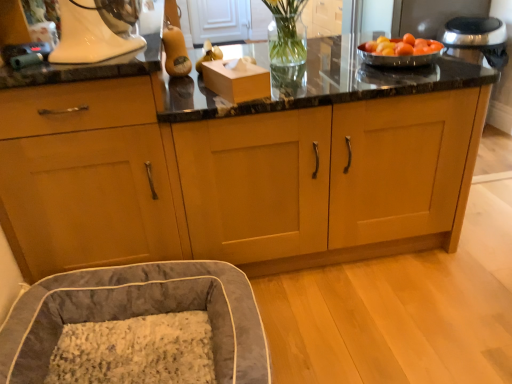
Locate an element on the screen. This screenshot has width=512, height=384. white glossy stand mixer at upper left is located at coordinates (96, 30).

At what (x,y) coordinates should I click in order to perform the action: click on matte wood cabinet at lower left, which appears as the 2th cabinetry when viewed from the right. Please return your answer as a coordinate pair (x, y). The image size is (512, 384). Looking at the image, I should click on (87, 178).

Describe the element at coordinates (87, 178) in the screenshot. I see `matte wood cabinet at lower left, which ranks as the first cabinetry in left-to-right order` at that location.

Locate an element on the screen. The image size is (512, 384). velvet gray bean bag at lower left is located at coordinates (138, 314).

In the scene shown: Is matte wood cabinet at lower left, which appears as the 2th cabinetry when viewed from the right, inside the boundaries of silver metallic bowl at upper right, or outside?

matte wood cabinet at lower left, which appears as the 2th cabinetry when viewed from the right, is outside silver metallic bowl at upper right.

Considering the sizes of objects matte wood cabinet at lower left, which appears as the 2th cabinetry when viewed from the right, and silver metallic bowl at upper right in the image provided, who is taller, matte wood cabinet at lower left, which appears as the 2th cabinetry when viewed from the right, or silver metallic bowl at upper right?

With more height is matte wood cabinet at lower left, which appears as the 2th cabinetry when viewed from the right.

From the picture: Does matte wood cabinet at lower left, which appears as the 2th cabinetry when viewed from the right, have a greater width compared to silver metallic bowl at upper right?

Yes.

From a real-world perspective, is matte wood cabinets at center, the 2th cabinetry when ordered from left to right, under matte wood cabinet at lower left, which ranks as the first cabinetry in left-to-right order?

Yes, from a real-world perspective, matte wood cabinets at center, the 2th cabinetry when ordered from left to right, is below matte wood cabinet at lower left, which ranks as the first cabinetry in left-to-right order.

Is matte wood cabinet at lower left, which appears as the 2th cabinetry when viewed from the right, at the back of matte wood cabinets at center, the 1th cabinetry in the right-to-left sequence?

No.

Can you confirm if matte wood cabinets at center, the 2th cabinetry when ordered from left to right, is smaller than matte wood cabinet at lower left, which ranks as the first cabinetry in left-to-right order?

Yes, matte wood cabinets at center, the 2th cabinetry when ordered from left to right, is smaller than matte wood cabinet at lower left, which ranks as the first cabinetry in left-to-right order.

From a real-world perspective, which object stands above the other?

In real-world perspective, matte wood cabinet at lower left, which appears as the 2th cabinetry when viewed from the right, is above.

Considering the relative sizes of matte wood cabinet at lower left, which ranks as the first cabinetry in left-to-right order, and velvet gray bean bag at lower left in the image provided, is matte wood cabinet at lower left, which ranks as the first cabinetry in left-to-right order, smaller than velvet gray bean bag at lower left?

Incorrect, matte wood cabinet at lower left, which ranks as the first cabinetry in left-to-right order, is not smaller in size than velvet gray bean bag at lower left.

Is matte wood cabinet at lower left, which ranks as the first cabinetry in left-to-right order, not within velvet gray bean bag at lower left?

matte wood cabinet at lower left, which ranks as the first cabinetry in left-to-right order, is positioned outside velvet gray bean bag at lower left.

Is velvet gray bean bag at lower left at the back of matte wood cabinet at lower left, which appears as the 2th cabinetry when viewed from the right?

No, matte wood cabinet at lower left, which appears as the 2th cabinetry when viewed from the right, is not facing the opposite direction of velvet gray bean bag at lower left.

Is matte wood cabinet at lower left, which ranks as the first cabinetry in left-to-right order, not within matte wood cabinets at center, the 1th cabinetry in the right-to-left sequence?

Indeed, matte wood cabinet at lower left, which ranks as the first cabinetry in left-to-right order, is completely outside matte wood cabinets at center, the 1th cabinetry in the right-to-left sequence.

Can you confirm if matte wood cabinet at lower left, which ranks as the first cabinetry in left-to-right order, is smaller than matte wood cabinets at center, the 1th cabinetry in the right-to-left sequence?

No.

How many degrees apart are the facing directions of matte wood cabinet at lower left, which appears as the 2th cabinetry when viewed from the right, and matte wood cabinets at center, the 2th cabinetry when ordered from left to right?

There is a 90-degree angle between the facing directions of matte wood cabinet at lower left, which appears as the 2th cabinetry when viewed from the right, and matte wood cabinets at center, the 2th cabinetry when ordered from left to right.

How much distance is there between matte wood cabinet at lower left, which ranks as the first cabinetry in left-to-right order, and matte wood cabinets at center, the 1th cabinetry in the right-to-left sequence?

matte wood cabinet at lower left, which ranks as the first cabinetry in left-to-right order, and matte wood cabinets at center, the 1th cabinetry in the right-to-left sequence, are 6.77 inches apart from each other.

Between point (269, 210) and point (393, 45), which one is positioned in front?

Positioned in front is point (269, 210).

How many degrees apart are the facing directions of matte wood cabinets at center, the 2th cabinetry when ordered from left to right, and silver metallic bowl at upper right?

They differ by 2.99 degrees in their facing directions.

From their relative heights in the image, would you say matte wood cabinets at center, the 1th cabinetry in the right-to-left sequence, is taller or shorter than silver metallic bowl at upper right?

In the image, matte wood cabinets at center, the 1th cabinetry in the right-to-left sequence, appears to be taller than silver metallic bowl at upper right.

This screenshot has height=384, width=512. What are the coordinates of `the 1st cabinetry to the left of the silver metallic bowl at upper right, counting from the anchor's position` in the screenshot? It's located at (239, 172).

Between point (375, 59) and point (251, 338), which one is positioned in front?

The point (251, 338) is closer to the camera.

How different are the orientations of silver metallic bowl at upper right and velvet gray bean bag at lower left in degrees?

The facing directions of silver metallic bowl at upper right and velvet gray bean bag at lower left are 3.19 degrees apart.

Which is more to the left, silver metallic bowl at upper right or velvet gray bean bag at lower left?

Positioned to the left is velvet gray bean bag at lower left.

From the image's perspective, is matte wood cabinets at center, the 2th cabinetry when ordered from left to right, below velvet gray bean bag at lower left?

No, from the image's perspective, matte wood cabinets at center, the 2th cabinetry when ordered from left to right, is not below velvet gray bean bag at lower left.

Choose the correct answer: Is matte wood cabinets at center, the 1th cabinetry in the right-to-left sequence, inside velvet gray bean bag at lower left or outside it?

matte wood cabinets at center, the 1th cabinetry in the right-to-left sequence, is not inside velvet gray bean bag at lower left, it's outside.

Is matte wood cabinets at center, the 1th cabinetry in the right-to-left sequence, shorter than velvet gray bean bag at lower left?

Incorrect, the height of matte wood cabinets at center, the 1th cabinetry in the right-to-left sequence, does not fall short of that of velvet gray bean bag at lower left.

Considering the positions of points (263, 172) and (221, 305), is point (263, 172) closer to camera compared to point (221, 305)?

No, it is behind (221, 305).

The image size is (512, 384). In order to click on kitchen appliance above the matte wood cabinet at lower left, which ranks as the first cabinetry in left-to-right order (from a real-world perspective) in this screenshot , I will do `click(400, 51)`.

Where is `cabinetry above the matte wood cabinets at center, the 2th cabinetry when ordered from left to right (from the image's perspective)`? Image resolution: width=512 pixels, height=384 pixels. cabinetry above the matte wood cabinets at center, the 2th cabinetry when ordered from left to right (from the image's perspective) is located at coordinates (87, 178).

Based on their spatial positions, is matte wood cabinet at lower left, which ranks as the first cabinetry in left-to-right order, or white glossy stand mixer at upper left further from velvet gray bean bag at lower left?

white glossy stand mixer at upper left lies further to velvet gray bean bag at lower left than the other object.

Which object lies nearer to the anchor point matte wood cabinet at lower left, which appears as the 2th cabinetry when viewed from the right, white glossy stand mixer at upper left or matte wood cabinets at center, the 1th cabinetry in the right-to-left sequence?

Based on the image, matte wood cabinets at center, the 1th cabinetry in the right-to-left sequence, appears to be nearer to matte wood cabinet at lower left, which appears as the 2th cabinetry when viewed from the right.

From the image, which object appears to be nearer to matte wood cabinets at center, the 2th cabinetry when ordered from left to right, matte wood cabinet at lower left, which ranks as the first cabinetry in left-to-right order, or silver metallic bowl at upper right?

matte wood cabinet at lower left, which ranks as the first cabinetry in left-to-right order.

From the image, which object appears to be nearer to velvet gray bean bag at lower left, white glossy stand mixer at upper left or matte wood cabinet at lower left, which appears as the 2th cabinetry when viewed from the right?

matte wood cabinet at lower left, which appears as the 2th cabinetry when viewed from the right.

From the image, which object appears to be farther from white glossy stand mixer at upper left, matte wood cabinets at center, the 2th cabinetry when ordered from left to right, or matte wood cabinet at lower left, which ranks as the first cabinetry in left-to-right order?

The object further to white glossy stand mixer at upper left is matte wood cabinets at center, the 2th cabinetry when ordered from left to right.

Considering their positions, is white glossy stand mixer at upper left positioned closer to matte wood cabinet at lower left, which ranks as the first cabinetry in left-to-right order, than silver metallic bowl at upper right?

white glossy stand mixer at upper left is closer to matte wood cabinet at lower left, which ranks as the first cabinetry in left-to-right order.

Considering their positions, is white glossy stand mixer at upper left positioned closer to silver metallic bowl at upper right than matte wood cabinet at lower left, which ranks as the first cabinetry in left-to-right order?

white glossy stand mixer at upper left is closer to silver metallic bowl at upper right.

Which object lies further to the anchor point velvet gray bean bag at lower left, silver metallic bowl at upper right or white glossy stand mixer at upper left?

silver metallic bowl at upper right.

Where is `cabinetry that lies between matte wood cabinet at lower left, which ranks as the first cabinetry in left-to-right order, and velvet gray bean bag at lower left from top to bottom`? This screenshot has height=384, width=512. cabinetry that lies between matte wood cabinet at lower left, which ranks as the first cabinetry in left-to-right order, and velvet gray bean bag at lower left from top to bottom is located at coordinates (239, 172).

Where is `cabinetry located between white glossy stand mixer at upper left and silver metallic bowl at upper right in the left-right direction`? The height and width of the screenshot is (384, 512). cabinetry located between white glossy stand mixer at upper left and silver metallic bowl at upper right in the left-right direction is located at coordinates (239, 172).

Locate an element on the screen. The height and width of the screenshot is (384, 512). kitchen appliance between white glossy stand mixer at upper left and velvet gray bean bag at lower left in the up-down direction is located at coordinates (400, 51).

Locate an element on the screen. This screenshot has height=384, width=512. cabinetry located between matte wood cabinet at lower left, which appears as the 2th cabinetry when viewed from the right, and silver metallic bowl at upper right in the left-right direction is located at coordinates (239, 172).